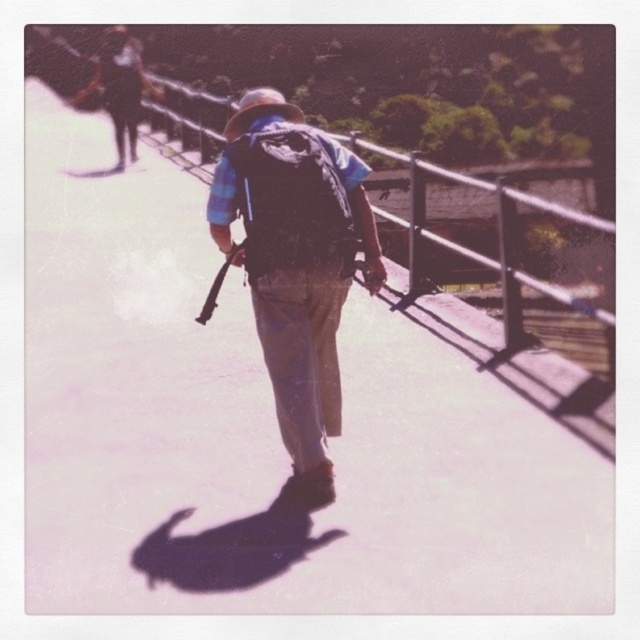
Question: From the image, what is the correct spatial relationship of matte blue backpack at center in relation to matte black backpack at center?

Choices:
 (A) left
 (B) right

Answer: (B)

Question: Does matte blue backpack at center appear over matte black backpack at center?

Choices:
 (A) no
 (B) yes

Answer: (A)

Question: Is matte blue backpack at center to the left of matte black backpack at center from the viewer's perspective?

Choices:
 (A) yes
 (B) no

Answer: (B)

Question: Which of the following is the closest to the observer?

Choices:
 (A) (344, 225)
 (B) (234, 140)

Answer: (A)